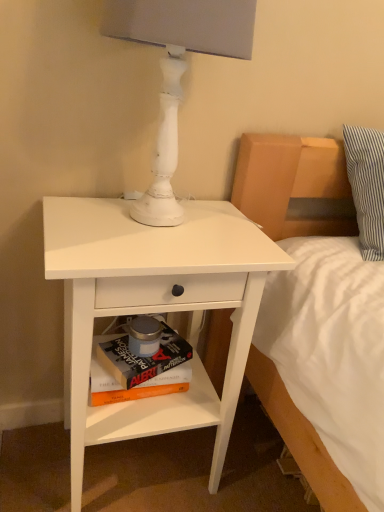
The image size is (384, 512). What do you see at coordinates (177, 71) in the screenshot? I see `white painted wood table lamp at upper center` at bounding box center [177, 71].

What is the approximate height of white painted wood table lamp at upper center?

white painted wood table lamp at upper center is 17.47 inches in height.

How much space does hardcover book at lower center, arranged as the 2th paperback book when viewed from the top, occupy vertically?

It is 3.14 inches.

Describe the element at coordinates (140, 362) in the screenshot. The image size is (384, 512). I see `hardcover book at lower center, positioned as the 1th paperback book in top-to-bottom order` at that location.

What are the coordinates of `white matte nightstand at lower left` in the screenshot? It's located at (153, 308).

You are a GUI agent. You are given a task and a screenshot of the screen. Output one action in this format:
    pyautogui.click(x=<x>, y=<y>)
    Task: Click on the white painted wood table lamp at upper center
    The height and width of the screenshot is (512, 384).
    Given the screenshot: What is the action you would take?
    pyautogui.click(x=177, y=71)

In the image, is hardcover book at lower center, positioned as the 1th paperback book in bottom-to-top order, on the left side or the right side of white painted wood table lamp at upper center?

Clearly, hardcover book at lower center, positioned as the 1th paperback book in bottom-to-top order, is on the left of white painted wood table lamp at upper center in the image.

Considering the sizes of objects hardcover book at lower center, arranged as the 2th paperback book when viewed from the top, and white painted wood table lamp at upper center in the image provided, who is taller, hardcover book at lower center, arranged as the 2th paperback book when viewed from the top, or white painted wood table lamp at upper center?

Standing taller between the two is white painted wood table lamp at upper center.

Is hardcover book at lower center, positioned as the 1th paperback book in bottom-to-top order, outside of white matte nightstand at lower left?

That's incorrect, hardcover book at lower center, positioned as the 1th paperback book in bottom-to-top order, is not completely outside white matte nightstand at lower left.

Is hardcover book at lower center, positioned as the 1th paperback book in bottom-to-top order, far from white matte nightstand at lower left?

They are positioned close to each other.

Which is more to the right, hardcover book at lower center, arranged as the 2th paperback book when viewed from the top, or white matte nightstand at lower left?

white matte nightstand at lower left.

Choose the correct answer: Is white matte nightstand at lower left inside hardcover book at lower center, positioned as the 1th paperback book in bottom-to-top order, or outside it?

white matte nightstand at lower left is not inside hardcover book at lower center, positioned as the 1th paperback book in bottom-to-top order, it's outside.

From a real-world perspective, is white matte nightstand at lower left beneath hardcover book at lower center, arranged as the 2th paperback book when viewed from the top?

No.

Can you tell me how much white matte nightstand at lower left and hardcover book at lower center, positioned as the 1th paperback book in bottom-to-top order, differ in facing direction?

white matte nightstand at lower left and hardcover book at lower center, positioned as the 1th paperback book in bottom-to-top order, are facing 0.216 degrees away from each other.

Would you say white matte nightstand at lower left is to the left or to the right of hardcover book at lower center, positioned as the 1th paperback book in bottom-to-top order, in the picture?

In the image, white matte nightstand at lower left appears on the right side of hardcover book at lower center, positioned as the 1th paperback book in bottom-to-top order.

Does white matte nightstand at lower left turn towards white painted wood table lamp at upper center?

No, white matte nightstand at lower left is not facing towards white painted wood table lamp at upper center.

Considering the relative sizes of white matte nightstand at lower left and white painted wood table lamp at upper center in the image provided, is white matte nightstand at lower left bigger than white painted wood table lamp at upper center?

Yes.

Would you say white matte nightstand at lower left is outside white painted wood table lamp at upper center?

Absolutely, white matte nightstand at lower left is external to white painted wood table lamp at upper center.

Is white matte nightstand at lower left closer to the viewer compared to white painted wood table lamp at upper center?

No, it is behind white painted wood table lamp at upper center.

Consider the image. Does hardcover book at lower center, positioned as the 1th paperback book in top-to-bottom order, have a lesser width compared to hardcover book at lower center, arranged as the 2th paperback book when viewed from the top?

Incorrect, the width of hardcover book at lower center, positioned as the 1th paperback book in top-to-bottom order, is not less than that of hardcover book at lower center, arranged as the 2th paperback book when viewed from the top.

The image size is (384, 512). I want to click on paperback book below the hardcover book at lower center, the 2th paperback book in the bottom-to-top sequence (from a real-world perspective), so tap(136, 385).

Is hardcover book at lower center, positioned as the 1th paperback book in top-to-bottom order, in front of hardcover book at lower center, positioned as the 1th paperback book in bottom-to-top order?

Yes.

Based on the photo, could hardcover book at lower center, positioned as the 1th paperback book in bottom-to-top order, be considered to be inside hardcover book at lower center, positioned as the 1th paperback book in top-to-bottom order?

Actually, hardcover book at lower center, positioned as the 1th paperback book in bottom-to-top order, is outside hardcover book at lower center, positioned as the 1th paperback book in top-to-bottom order.

Who is taller, hardcover book at lower center, the 2th paperback book in the bottom-to-top sequence, or white matte nightstand at lower left?

With more height is white matte nightstand at lower left.

Could you tell me if hardcover book at lower center, the 2th paperback book in the bottom-to-top sequence, is turned towards white matte nightstand at lower left?

Yes, hardcover book at lower center, the 2th paperback book in the bottom-to-top sequence, is facing white matte nightstand at lower left.

Which is more to the left, hardcover book at lower center, positioned as the 1th paperback book in top-to-bottom order, or white matte nightstand at lower left?

From the viewer's perspective, hardcover book at lower center, positioned as the 1th paperback book in top-to-bottom order, appears more on the left side.

The width and height of the screenshot is (384, 512). What are the coordinates of `paperback book on the left side of hardcover book at lower center, positioned as the 1th paperback book in top-to-bottom order` in the screenshot? It's located at (136, 385).

From the image's perspective, is hardcover book at lower center, positioned as the 1th paperback book in bottom-to-top order, below hardcover book at lower center, positioned as the 1th paperback book in top-to-bottom order?

Indeed, from the image's perspective, hardcover book at lower center, positioned as the 1th paperback book in bottom-to-top order, is shown beneath hardcover book at lower center, positioned as the 1th paperback book in top-to-bottom order.

Which of these two, hardcover book at lower center, positioned as the 1th paperback book in bottom-to-top order, or hardcover book at lower center, the 2th paperback book in the bottom-to-top sequence, is smaller?

hardcover book at lower center, the 2th paperback book in the bottom-to-top sequence, is smaller.

You are a GUI agent. You are given a task and a screenshot of the screen. Output one action in this format:
    pyautogui.click(x=<x>, y=<y>)
    Task: Click on the paperback book that is the 2nd object directly below the white painted wood table lamp at upper center (from a real-world perspective)
    The image size is (384, 512).
    Given the screenshot: What is the action you would take?
    pyautogui.click(x=136, y=385)

Image resolution: width=384 pixels, height=512 pixels. Identify the location of nightstand above the hardcover book at lower center, positioned as the 1th paperback book in bottom-to-top order (from the image's perspective). (153, 308).

From the image, which object appears to be farther from hardcover book at lower center, positioned as the 1th paperback book in bottom-to-top order, white painted wood table lamp at upper center or hardcover book at lower center, the 2th paperback book in the bottom-to-top sequence?

white painted wood table lamp at upper center is further to hardcover book at lower center, positioned as the 1th paperback book in bottom-to-top order.

Which object lies nearer to the anchor point white matte nightstand at lower left, hardcover book at lower center, positioned as the 1th paperback book in top-to-bottom order, or hardcover book at lower center, arranged as the 2th paperback book when viewed from the top?

Based on the image, hardcover book at lower center, positioned as the 1th paperback book in top-to-bottom order, appears to be nearer to white matte nightstand at lower left.

Considering their positions, is hardcover book at lower center, the 2th paperback book in the bottom-to-top sequence, positioned further to hardcover book at lower center, positioned as the 1th paperback book in bottom-to-top order, than white matte nightstand at lower left?

Among the two, white matte nightstand at lower left is located further to hardcover book at lower center, positioned as the 1th paperback book in bottom-to-top order.

From the image, which object appears to be farther from hardcover book at lower center, the 2th paperback book in the bottom-to-top sequence, white matte nightstand at lower left or white painted wood table lamp at upper center?

white painted wood table lamp at upper center.

Which object lies further to the anchor point white painted wood table lamp at upper center, white matte nightstand at lower left or hardcover book at lower center, positioned as the 1th paperback book in bottom-to-top order?

Among the two, hardcover book at lower center, positioned as the 1th paperback book in bottom-to-top order, is located further to white painted wood table lamp at upper center.

When comparing their distances from white painted wood table lamp at upper center, does hardcover book at lower center, the 2th paperback book in the bottom-to-top sequence, or white matte nightstand at lower left seem closer?

white matte nightstand at lower left is closer to white painted wood table lamp at upper center.

When comparing their distances from white painted wood table lamp at upper center, does white matte nightstand at lower left or hardcover book at lower center, the 2th paperback book in the bottom-to-top sequence, seem further?

The object further to white painted wood table lamp at upper center is hardcover book at lower center, the 2th paperback book in the bottom-to-top sequence.

Looking at the image, which one is located further to white painted wood table lamp at upper center, hardcover book at lower center, the 2th paperback book in the bottom-to-top sequence, or hardcover book at lower center, arranged as the 2th paperback book when viewed from the top?

The object further to white painted wood table lamp at upper center is hardcover book at lower center, arranged as the 2th paperback book when viewed from the top.

You are a GUI agent. You are given a task and a screenshot of the screen. Output one action in this format:
    pyautogui.click(x=<x>, y=<y>)
    Task: Click on the paperback book between white matte nightstand at lower left and hardcover book at lower center, positioned as the 1th paperback book in bottom-to-top order, from front to back
    
    Given the screenshot: What is the action you would take?
    click(x=140, y=362)

The image size is (384, 512). Identify the location of paperback book between white painted wood table lamp at upper center and hardcover book at lower center, positioned as the 1th paperback book in bottom-to-top order, from top to bottom. (140, 362).

The image size is (384, 512). I want to click on nightstand between white painted wood table lamp at upper center and hardcover book at lower center, positioned as the 1th paperback book in top-to-bottom order, from top to bottom, so click(153, 308).

Find the location of `nightstand between white painted wood table lamp at upper center and hardcover book at lower center, positioned as the 1th paperback book in bottom-to-top order, in the vertical direction`. nightstand between white painted wood table lamp at upper center and hardcover book at lower center, positioned as the 1th paperback book in bottom-to-top order, in the vertical direction is located at coordinates (153, 308).